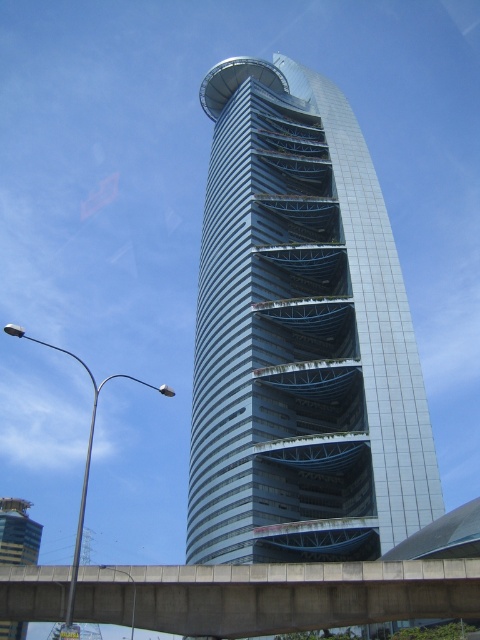
You are a construction worker tasked with placing a 30 meter long steel beam between the two closest points of the concrete bridge at center and the building. Will the beam fit without bending?

The distance between the concrete bridge at center and the building is 34.75 meters. Since the steel beam is 30 meters long, it will fit without bending as it is shorter than the distance between them.

You are an architect analyzing the layout of a city block. You notice the metallic glass tower at center and the metallic silver tower at lower left in the image. Based on their positions, which tower is positioned higher in the image?

The metallic glass tower at center is positioned higher in the image than the metallic silver tower at lower left.